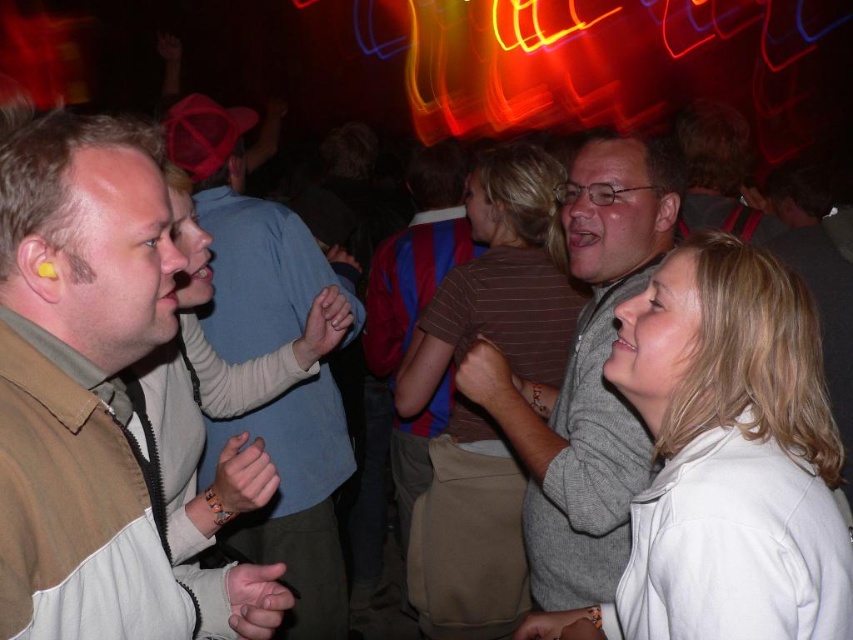
Is gray sweater at center positioned behind light blue shirt at left?

No.

Is gray sweater at center closer to camera compared to light blue shirt at left?

Yes, gray sweater at center is in front of light blue shirt at left.

You are a GUI agent. You are given a task and a screenshot of the screen. Output one action in this format:
    pyautogui.click(x=<x>, y=<y>)
    Task: Click on the gray sweater at center
    
    Given the screenshot: What is the action you would take?
    pyautogui.click(x=585, y=378)

This screenshot has width=853, height=640. What are the coordinates of `gray sweater at center` in the screenshot? It's located at (585, 378).

Can you confirm if striped shirt at center is positioned above matte brown shirt at center?

No.

Is striped shirt at center closer to camera compared to matte brown shirt at center?

No, it is behind matte brown shirt at center.

Describe the element at coordinates (416, 307) in the screenshot. I see `striped shirt at center` at that location.

Locate an element on the screen. striped shirt at center is located at coordinates (416, 307).

Between point (421, 483) and point (689, 296), which one is positioned behind?

The point (421, 483) is behind.

Does striped shirt at center appear on the left side of smooth beige jacket at lower right?

Yes, striped shirt at center is to the left of smooth beige jacket at lower right.

At what (x,y) coordinates should I click in order to perform the action: click on striped shirt at center. Please return your answer as a coordinate pair (x, y). This screenshot has height=640, width=853. Looking at the image, I should click on (416, 307).

I want to click on striped shirt at center, so click(x=416, y=307).